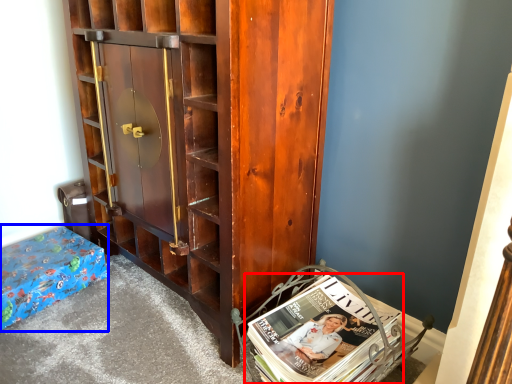
Question: Which of the following is the closest to the observer, book (highlighted by a red box) or furniture (highlighted by a blue box)?

Choices:
 (A) book
 (B) furniture

Answer: (A)